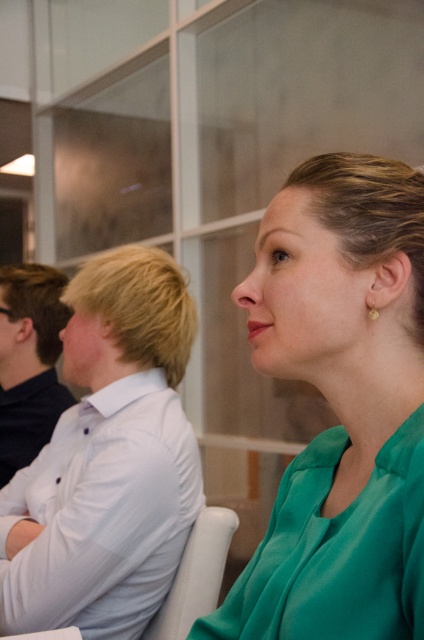
You are a photographer trying to capture a closeup of the green satin blouse at center. Given that the camera is positioned at the origin point of the coordinate system, what direction should you move the camera to focus on the blouse?

The green satin blouse at center is located at coordinates point (340,406), so you should move the camera to the right and upwards to focus on it.

You are a photographer setting up for an indoor event. You need to ensure that the green satin blouse at center and the white shirt at left are both visible in your photo. Based on their positions, which one is closer to the camera?

The green satin blouse at center is positioned over the white shirt at left, so it is closer to the camera.

You are organizing a photo shoot and need to ensure that the green satin blouse at center and the white shirt at left are visible in the frame. Given their sizes, which one should you adjust the camera focus on to ensure both are in focus?

The green satin blouse at center is smaller than the white shirt at left. To ensure both are in focus, adjust the camera focus on the larger object, the white shirt at left, as it requires more attention due to its size.